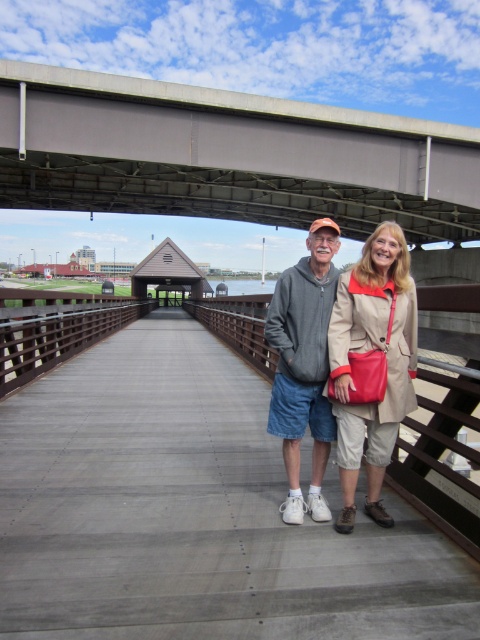
Question: Which of the following is the farthest from the observer?

Choices:
 (A) (179, 205)
 (B) (335, 428)
 (C) (375, 452)

Answer: (A)

Question: Does beige textured coat at center come in front of gray fleece jacket at center?

Choices:
 (A) yes
 (B) no

Answer: (A)

Question: Considering the real-world distances, which object is closest to the concrete bridge at upper center?

Choices:
 (A) beige textured coat at center
 (B) gray fleece jacket at center

Answer: (B)

Question: Considering the relative positions of concrete bridge at upper center and beige textured coat at center in the image provided, where is concrete bridge at upper center located with respect to beige textured coat at center?

Choices:
 (A) above
 (B) below

Answer: (A)

Question: Which object is the closest to the gray fleece jacket at center?

Choices:
 (A) concrete bridge at upper center
 (B) beige textured coat at center

Answer: (B)

Question: Does concrete bridge at upper center have a larger size compared to beige textured coat at center?

Choices:
 (A) yes
 (B) no

Answer: (A)